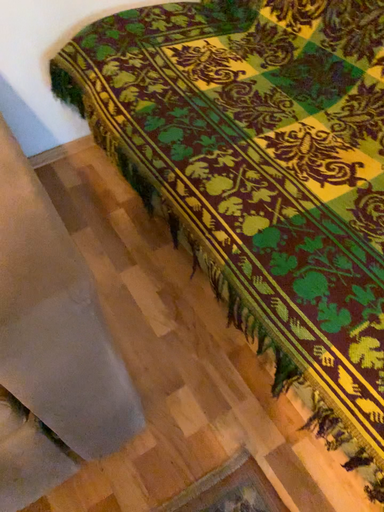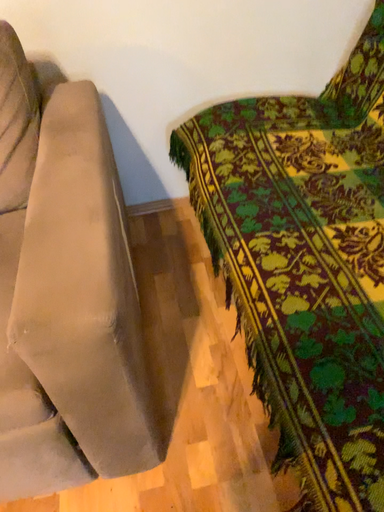
Question: How did the camera likely rotate when shooting the video?

Choices:
 (A) rotated left
 (B) rotated right

Answer: (A)